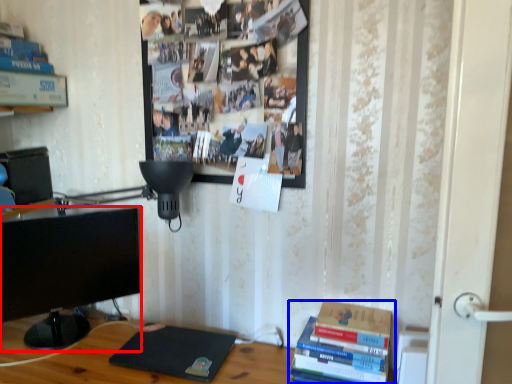
Question: Which point is further to the camera, television (highlighted by a red box) or book (highlighted by a blue box)?

Choices:
 (A) television
 (B) book

Answer: (A)